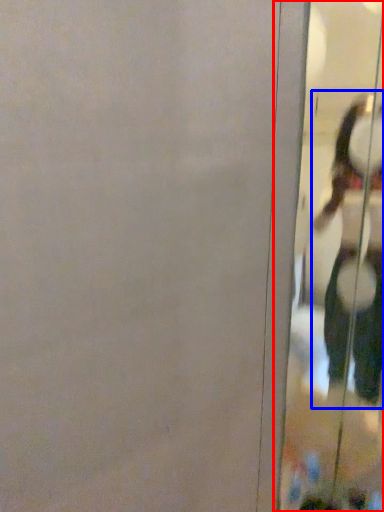
Question: Which of the following is the farthest to the observer, screen door (highlighted by a red box) or person (highlighted by a blue box)?

Choices:
 (A) screen door
 (B) person

Answer: (B)